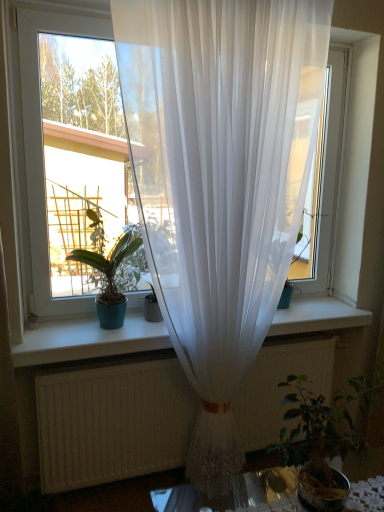
Question: Is translucent white curtain at center bigger than transparent white curtain at center?

Choices:
 (A) yes
 (B) no

Answer: (A)

Question: Is there a large distance between translucent white curtain at center and transparent white curtain at center?

Choices:
 (A) no
 (B) yes

Answer: (A)

Question: From the image's perspective, would you say translucent white curtain at center is positioned over transparent white curtain at center?

Choices:
 (A) no
 (B) yes

Answer: (A)

Question: From the image's perspective, is translucent white curtain at center located beneath transparent white curtain at center?

Choices:
 (A) yes
 (B) no

Answer: (A)

Question: From a real-world perspective, is translucent white curtain at center beneath transparent white curtain at center?

Choices:
 (A) no
 (B) yes

Answer: (B)

Question: Considering the relative sizes of translucent white curtain at center and transparent white curtain at center in the image provided, is translucent white curtain at center taller than transparent white curtain at center?

Choices:
 (A) yes
 (B) no

Answer: (A)

Question: Would you say translucent white curtain at center contains green leafy plant at lower right, the 1th houseplant in the front-to-back sequence?

Choices:
 (A) no
 (B) yes

Answer: (A)

Question: Could you tell me if translucent white curtain at center is facing green leafy plant at lower right, the first houseplant ordered from the bottom?

Choices:
 (A) no
 (B) yes

Answer: (B)

Question: Is translucent white curtain at center not close to green leafy plant at lower right, the first houseplant ordered from the bottom?

Choices:
 (A) yes
 (B) no

Answer: (B)

Question: Does translucent white curtain at center have a larger size compared to green leafy plant at lower right, the first houseplant from the right?

Choices:
 (A) no
 (B) yes

Answer: (B)

Question: From a real-world perspective, is translucent white curtain at center physically below green leafy plant at lower right, marked as the 2th houseplant in a left-to-right arrangement?

Choices:
 (A) yes
 (B) no

Answer: (B)

Question: Can you confirm if translucent white curtain at center is smaller than green leafy plant at lower right, placed as the second houseplant when sorted from back to front?

Choices:
 (A) no
 (B) yes

Answer: (A)

Question: Is green leafy plant at lower right, marked as the second houseplant in a top-to-bottom arrangement, inside transparent white curtain at center?

Choices:
 (A) yes
 (B) no

Answer: (B)